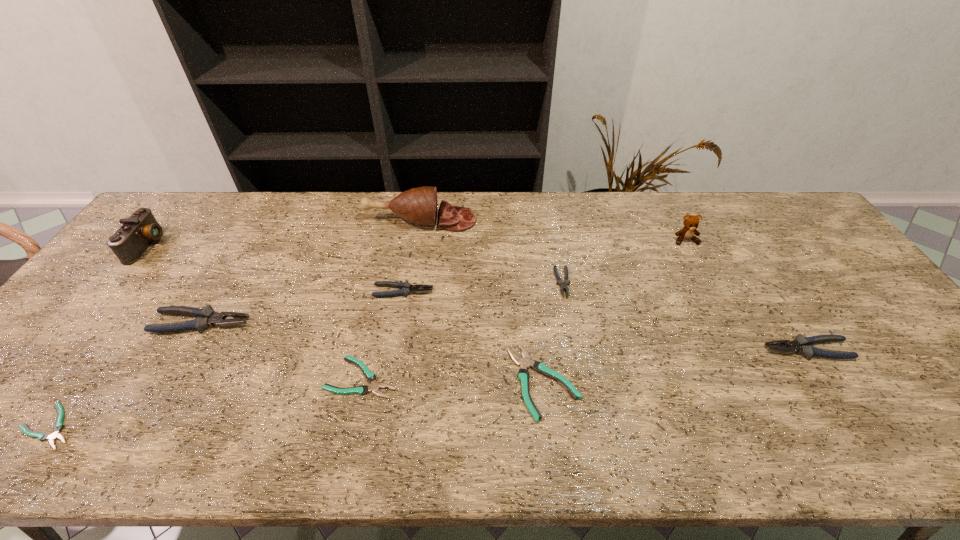
The width and height of the screenshot is (960, 540). What are the coordinates of `vacant position at the far right corner of the desktop` in the screenshot? It's located at (804, 219).

Locate an element on the screen. The height and width of the screenshot is (540, 960). vacant space that's between the third smallest gray pliers and the second shortest object is located at coordinates 584,363.

Find the location of a particular element. This screenshot has width=960, height=540. vacant space that's between the camera and the third shortest pliers is located at coordinates (346, 313).

Locate an element on the screen. free spot between the shortest object and the rightmost teal pliers is located at coordinates (297, 403).

This screenshot has width=960, height=540. Identify the location of vacant area between the second teal pliers from left to right and the leftmost pliers. (206, 402).

The height and width of the screenshot is (540, 960). Identify the location of unoccupied area between the sixth tallest pliers and the shortest pliers. (206, 402).

In order to click on blank region between the shortest object and the teddy bear in this screenshot , I will do click(368, 333).

I want to click on blank region between the third tallest pliers and the sixth pliers from right to left, so click(x=302, y=307).

Where is `free space between the second gray pliers from right to left and the second teal pliers from left to right`? The height and width of the screenshot is (540, 960). free space between the second gray pliers from right to left and the second teal pliers from left to right is located at coordinates (462, 330).

Image resolution: width=960 pixels, height=540 pixels. I want to click on unoccupied area between the sixth tallest object and the second object from right to left, so click(544, 266).